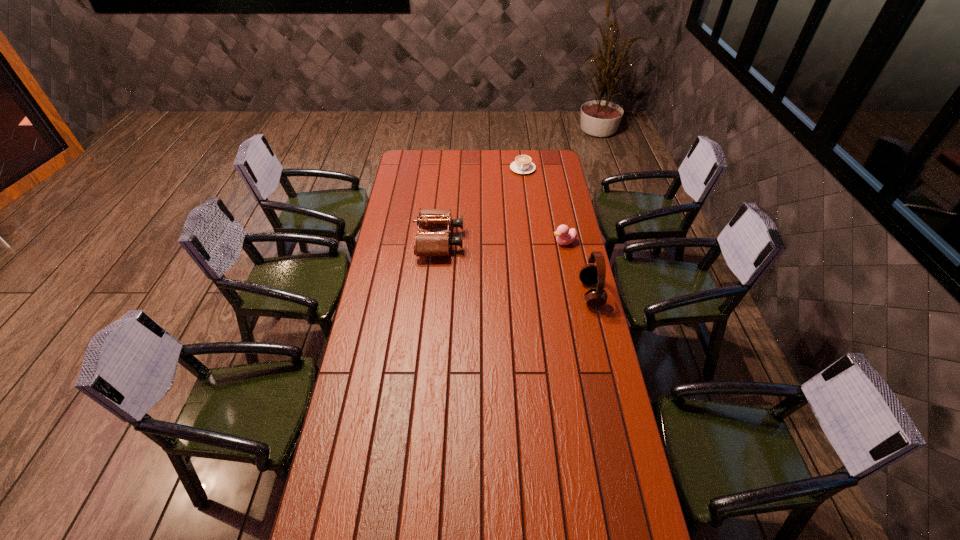
Locate an element on the screen. Image resolution: width=960 pixels, height=540 pixels. vacant space positioned 0.200m on the ear pads of the headset is located at coordinates (532, 293).

Where is `vacant position located on the side of the cappuccino with the handle`? vacant position located on the side of the cappuccino with the handle is located at coordinates pos(512,214).

This screenshot has height=540, width=960. I want to click on free point located on the side of the cappuccino with the handle, so click(514, 205).

Find the location of a particular element. This screenshot has width=960, height=540. vacant space located on the side of the cappuccino with the handle is located at coordinates (513, 211).

Find the location of a particular element. blank space located on the front-facing side of the duckling is located at coordinates (510, 260).

Find the location of a particular element. vacant space located 0.100m on the front-facing side of the duckling is located at coordinates (535, 251).

Find the location of a particular element. The width and height of the screenshot is (960, 540). vacant space located on the front-facing side of the duckling is located at coordinates (527, 254).

Identify the location of object that is positioned at the far edge. The height and width of the screenshot is (540, 960). (522, 164).

Locate an element on the screen. This screenshot has width=960, height=540. object located in the left edge section of the desktop is located at coordinates (430, 243).

The height and width of the screenshot is (540, 960). I want to click on headset located at the right edge, so click(590, 274).